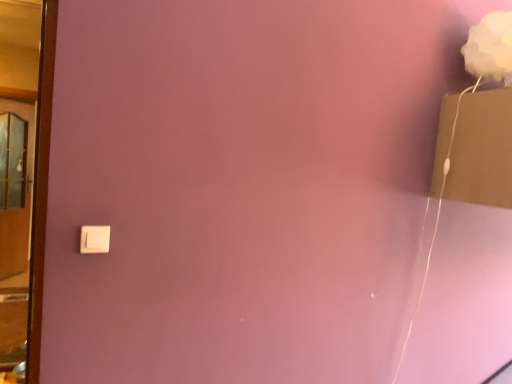
Identify the location of wooden door at left. The width and height of the screenshot is (512, 384). (15, 231).

The height and width of the screenshot is (384, 512). What do you see at coordinates (490, 47) in the screenshot? I see `white matte flower at upper right` at bounding box center [490, 47].

Find the location of a particular element. The width and height of the screenshot is (512, 384). white plastic light switch at lower left is located at coordinates (94, 239).

Image resolution: width=512 pixels, height=384 pixels. In order to click on wooden door at left in this screenshot , I will do `click(15, 231)`.

Is white plastic light switch at lower left closer to the viewer compared to white matte flower at upper right?

Yes, white plastic light switch at lower left is closer to the viewer.

From the image's perspective, is white plastic light switch at lower left above or below white matte flower at upper right?

Clearly, from the image's perspective, white plastic light switch at lower left is below white matte flower at upper right.

Could white matte flower at upper right be considered to be inside white plastic light switch at lower left?

That's incorrect, white matte flower at upper right is not inside white plastic light switch at lower left.

Considering the relative sizes of white plastic light switch at lower left and white matte flower at upper right in the image provided, is white plastic light switch at lower left shorter than white matte flower at upper right?

Yes.

From a real-world perspective, which object stands above the other?

white matte flower at upper right is physically above.

Find the location of a particular element. The image size is (512, 384). flower that appears above the wooden door at left (from a real-world perspective) is located at coordinates (490, 47).

Which is behind, point (503, 72) or point (18, 109)?

The point (18, 109) is behind.

Is white matte flower at upper right to the left or to the right of wooden door at left in the image?

From the image, it's evident that white matte flower at upper right is to the right of wooden door at left.

Identify the location of door positioned vertically above the white plastic light switch at lower left (from a real-world perspective). This screenshot has height=384, width=512. (15, 231).

Is white plastic light switch at lower left located outside wooden door at left?

Yes, white plastic light switch at lower left is located beyond the bounds of wooden door at left.

From the image's perspective, which one is positioned higher, white plastic light switch at lower left or wooden door at left?

wooden door at left.

Considering the sizes of objects wooden door at left and white plastic light switch at lower left in the image provided, who is wider, wooden door at left or white plastic light switch at lower left?

wooden door at left.

Could you tell me if wooden door at left is turned towards white plastic light switch at lower left?

No, wooden door at left is not oriented towards white plastic light switch at lower left.

From a real-world perspective, who is located higher, wooden door at left or white plastic light switch at lower left?

In real-world perspective, wooden door at left is above.

Is the depth of wooden door at left greater than that of white plastic light switch at lower left?

No, wooden door at left is closer to the viewer.

Is wooden door at left shorter than white matte flower at upper right?

No, wooden door at left is not shorter than white matte flower at upper right.

Does wooden door at left appear on the right side of white matte flower at upper right?

In fact, wooden door at left is to the left of white matte flower at upper right.

Is wooden door at left oriented away from white matte flower at upper right?

No, wooden door at left is not facing the opposite direction of white matte flower at upper right.

Is the surface of white matte flower at upper right in direct contact with white plastic light switch at lower left?

No, white matte flower at upper right is not touching white plastic light switch at lower left.

How far apart are white matte flower at upper right and white plastic light switch at lower left?

A distance of 4.95 feet exists between white matte flower at upper right and white plastic light switch at lower left.

Considering the positions of objects white matte flower at upper right and white plastic light switch at lower left in the image provided, who is behind, white matte flower at upper right or white plastic light switch at lower left?

Positioned behind is white matte flower at upper right.

Which point is more distant from viewer, (503, 50) or (94, 231)?

The point (503, 50) is more distant.

This screenshot has height=384, width=512. Find the location of `light switch lying on the left of white matte flower at upper right`. light switch lying on the left of white matte flower at upper right is located at coordinates (94, 239).

This screenshot has width=512, height=384. In the image, there is a white matte flower at upper right. Identify the location of door below it (from a real-world perspective). (15, 231).

When comparing their distances from white matte flower at upper right, does wooden door at left or white plastic light switch at lower left seem closer?

white plastic light switch at lower left.

Estimate the real-world distances between objects in this image. Which object is closer to white plastic light switch at lower left, white matte flower at upper right or wooden door at left?

white matte flower at upper right is positioned closer to the anchor white plastic light switch at lower left.

Based on their spatial positions, is white plastic light switch at lower left or wooden door at left further from white matte flower at upper right?

Based on the image, wooden door at left appears to be further to white matte flower at upper right.

Which object lies nearer to the anchor point wooden door at left, white plastic light switch at lower left or white matte flower at upper right?

white plastic light switch at lower left lies closer to wooden door at left than the other object.

From the picture: Looking at the image, which one is located further to white plastic light switch at lower left, wooden door at left or white matte flower at upper right?

The object further to white plastic light switch at lower left is wooden door at left.

Consider the image. From the image, which object appears to be farther from wooden door at left, white matte flower at upper right or white plastic light switch at lower left?

white matte flower at upper right is further to wooden door at left.

Locate an element on the screen. Image resolution: width=512 pixels, height=384 pixels. light switch located between wooden door at left and white matte flower at upper right in the left-right direction is located at coordinates (94, 239).